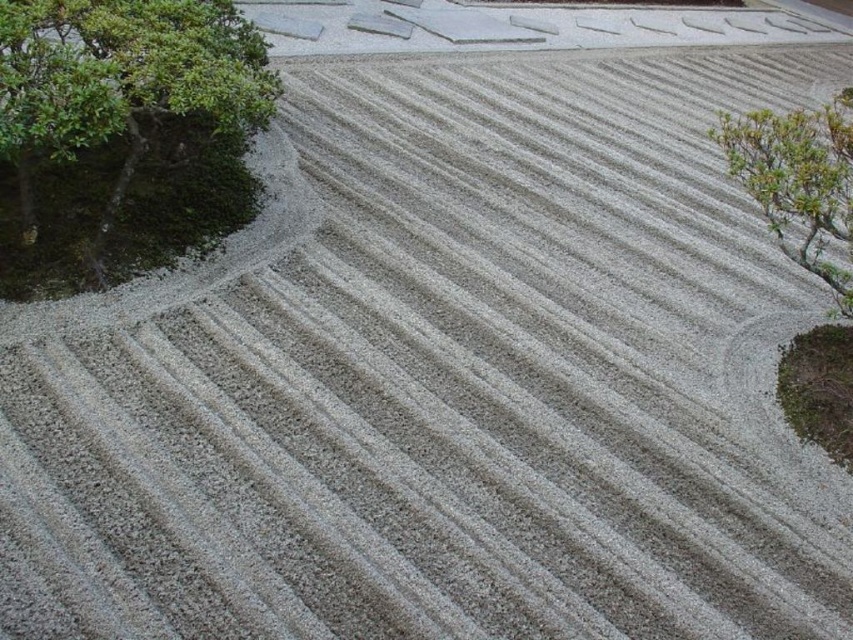
You are standing in the Japanese rock garden and want to place a small statue between the green leafy tree at upper left and the green leafy bush at upper right. Based on their positions, where should you place the statue to ensure it is between them?

The green leafy tree at upper left is located above the green leafy bush at upper right, so placing the statue between them would require positioning it below the tree and above the bush.

Based on the scene description, where is the green leafy tree at upper left located in the image?

The green leafy tree at upper left is located at the coordinates point [122,134] in the image.